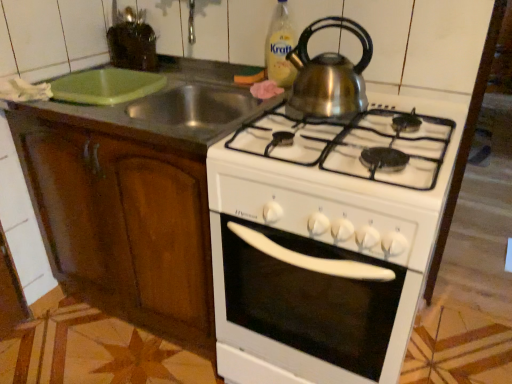
Question: Can you confirm if shiny metallic kettle at upper center is wider than wooden cabinet at left?

Choices:
 (A) yes
 (B) no

Answer: (B)

Question: Are shiny metallic kettle at upper center and wooden cabinet at left located far from each other?

Choices:
 (A) no
 (B) yes

Answer: (A)

Question: Considering the relative sizes of shiny metallic kettle at upper center and wooden cabinet at left in the image provided, is shiny metallic kettle at upper center shorter than wooden cabinet at left?

Choices:
 (A) no
 (B) yes

Answer: (B)

Question: Would you say wooden cabinet at left is part of shiny metallic kettle at upper center's contents?

Choices:
 (A) no
 (B) yes

Answer: (A)

Question: Can you confirm if shiny metallic kettle at upper center is thinner than wooden cabinet at left?

Choices:
 (A) yes
 (B) no

Answer: (A)

Question: From the image's perspective, is green plastic cutting board at upper left located above or below wooden cabinet at left?

Choices:
 (A) below
 (B) above

Answer: (B)

Question: Is green plastic cutting board at upper left wider or thinner than wooden cabinet at left?

Choices:
 (A) thin
 (B) wide

Answer: (B)

Question: Do you think green plastic cutting board at upper left is within wooden cabinet at left, or outside of it?

Choices:
 (A) outside
 (B) inside

Answer: (B)

Question: In terms of size, does green plastic cutting board at upper left appear bigger or smaller than wooden cabinet at left?

Choices:
 (A) big
 (B) small

Answer: (B)

Question: Is white glossy oven at center wider or thinner than shiny metallic kettle at upper center?

Choices:
 (A) thin
 (B) wide

Answer: (B)

Question: From a real-world perspective, is white glossy oven at center physically located above or below shiny metallic kettle at upper center?

Choices:
 (A) below
 (B) above

Answer: (A)

Question: Is white glossy oven at center taller or shorter than shiny metallic kettle at upper center?

Choices:
 (A) tall
 (B) short

Answer: (A)

Question: Considering their positions, is white glossy oven at center located in front of or behind shiny metallic kettle at upper center?

Choices:
 (A) front
 (B) behind

Answer: (A)

Question: Based on their sizes in the image, would you say wooden cabinet at left is bigger or smaller than translucent plastic bottle at upper center?

Choices:
 (A) big
 (B) small

Answer: (A)

Question: From a real-world perspective, is wooden cabinet at left physically located above or below translucent plastic bottle at upper center?

Choices:
 (A) above
 (B) below

Answer: (B)